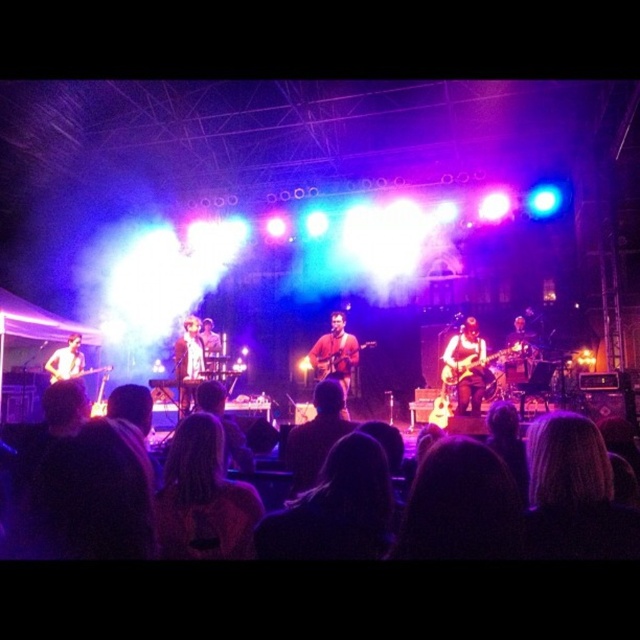
Question: Is black hair at lower center closer to camera compared to matte black guitar at left?

Choices:
 (A) no
 (B) yes

Answer: (B)

Question: Among these objects, which one is farthest from the camera?

Choices:
 (A) wooden acoustic guitar at center
 (B) matte black guitar at center
 (C) matte black guitar at left

Answer: (C)

Question: Which of the following is the farthest from the observer?

Choices:
 (A) (68, 378)
 (B) (182, 390)
 (C) (312, 346)

Answer: (C)

Question: Does matte black guitar at left appear under smooth wooden guitar at center?

Choices:
 (A) yes
 (B) no

Answer: (A)

Question: Does matte brown guitar at center appear on the left side of smooth wooden guitar at center?

Choices:
 (A) yes
 (B) no

Answer: (B)

Question: Which of the following is the farthest from the observer?

Choices:
 (A) (77, 333)
 (B) (202, 346)

Answer: (A)